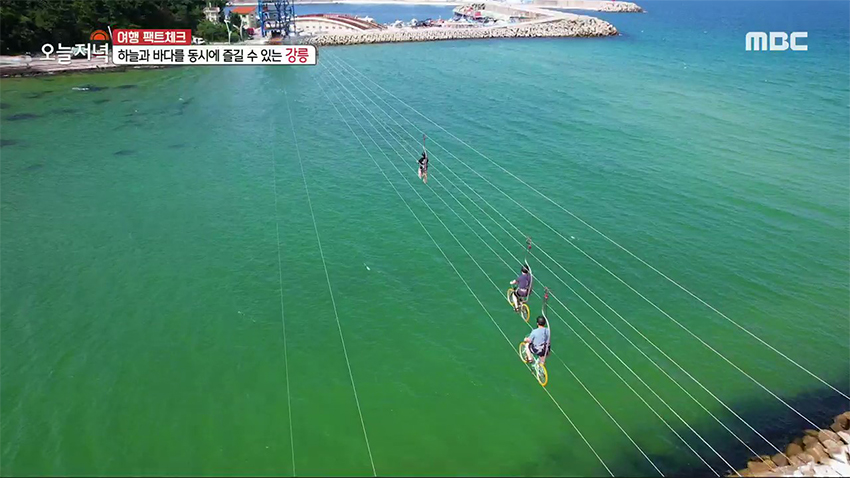
Image resolution: width=850 pixels, height=478 pixels. What are the coordinates of `cable` in the screenshot? It's located at (698, 301).